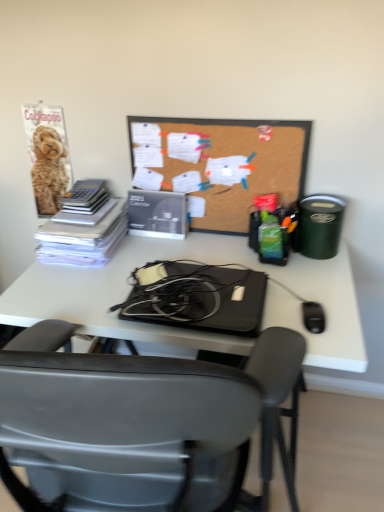
This screenshot has height=512, width=384. What are the coordinates of `matte black calendar at center` in the screenshot? It's located at (157, 214).

Describe the element at coordinates (196, 297) in the screenshot. This screenshot has width=384, height=512. I see `black matte laptop at center` at that location.

This screenshot has width=384, height=512. What are the coordinates of `white paper stack at left` in the screenshot? It's located at (84, 227).

What do you see at coordinates (313, 317) in the screenshot? The height and width of the screenshot is (512, 384). I see `black plastic mouse at lower right` at bounding box center [313, 317].

Locate an element on the screen. matte black calendar at center is located at coordinates (157, 214).

Is black matte laptop at center situated inside matte black calendar at center or outside?

black matte laptop at center is spatially situated outside matte black calendar at center.

Who is taller, black matte laptop at center or matte black calendar at center?

With more height is matte black calendar at center.

From the image's perspective, would you say black matte laptop at center is shown under matte black calendar at center?

Yes, from the image's perspective, black matte laptop at center is beneath matte black calendar at center.

Can you confirm if black plastic chair at center is thinner than matte black calendar at center?

Incorrect, the width of black plastic chair at center is not less than that of matte black calendar at center.

Looking at the image, does black plastic chair at center seem bigger or smaller compared to matte black calendar at center?

Clearly, black plastic chair at center is larger in size than matte black calendar at center.

Which of these two, corkboard at center or black plastic mouse at lower right, is wider?

With larger width is black plastic mouse at lower right.

Where is `bulletin board on the left of black plastic mouse at lower right`? Image resolution: width=384 pixels, height=512 pixels. bulletin board on the left of black plastic mouse at lower right is located at coordinates (220, 164).

Is corkboard at center located outside black plastic mouse at lower right?

Indeed, corkboard at center is completely outside black plastic mouse at lower right.

From their relative heights in the image, would you say corkboard at center is taller or shorter than black plastic mouse at lower right?

In the image, corkboard at center appears to be taller than black plastic mouse at lower right.

In terms of height, does black plastic mouse at lower right look taller or shorter compared to white paper stack at left?

Clearly, black plastic mouse at lower right is shorter compared to white paper stack at left.

Considering the relative positions of black plastic mouse at lower right and white paper stack at left in the image provided, is black plastic mouse at lower right to the left of white paper stack at left from the viewer's perspective?

No, black plastic mouse at lower right is not to the left of white paper stack at left.

Is the position of black plastic mouse at lower right more distant than that of white paper stack at left?

No.

Which of these two, black plastic mouse at lower right or white paper stack at left, is thinner?

black plastic mouse at lower right.

From the picture: What's the angular difference between black matte laptop at center and corkboard at center's facing directions?

The facing directions of black matte laptop at center and corkboard at center are 0.0148 degrees apart.

Is black matte laptop at center looking in the opposite direction of corkboard at center?

Yes, black matte laptop at center is facing away from corkboard at center.

Are black matte laptop at center and corkboard at center making contact?

There is a gap between black matte laptop at center and corkboard at center.

Is the position of black matte laptop at center less distant than that of black plastic chair at center?

No, black matte laptop at center is further to the viewer.

Consider the image. From a real-world perspective, is black matte laptop at center positioned above or below black plastic chair at center?

Clearly, from a real-world perspective, black matte laptop at center is above black plastic chair at center.

Considering the points (253, 277) and (134, 490), which point is in front, point (253, 277) or point (134, 490)?

The point (134, 490) is more forward.

From the image's perspective, is black matte laptop at center under black plastic chair at center?

No, from the image's perspective, black matte laptop at center is not below black plastic chair at center.

Considering the relative positions of black plastic mouse at lower right and black matte laptop at center in the image provided, is black plastic mouse at lower right behind black matte laptop at center?

Yes, it is behind black matte laptop at center.

Is black plastic mouse at lower right at the right side of black matte laptop at center?

Yes.

Considering the relative sizes of black plastic mouse at lower right and black matte laptop at center in the image provided, is black plastic mouse at lower right thinner than black matte laptop at center?

Yes.

You are a GUI agent. You are given a task and a screenshot of the screen. Output one action in this format:
    pyautogui.click(x=<x>, y=<y>)
    Task: Click on the laptop beneath the matte black calendar at center (from a real-world perspective)
    
    Given the screenshot: What is the action you would take?
    pyautogui.click(x=196, y=297)

The height and width of the screenshot is (512, 384). In order to click on chair below the matte black calendar at center (from the image's perspective) in this screenshot , I will do `click(138, 423)`.

Looking at the image, which one is located further to black plastic chair at center, corkboard at center or black plastic mouse at lower right?

corkboard at center.

When comparing their distances from matte black calendar at center, does black plastic mouse at lower right or corkboard at center seem further?

Among the two, black plastic mouse at lower right is located further to matte black calendar at center.

Estimate the real-world distances between objects in this image. Which object is further from black plastic chair at center, corkboard at center or black matte laptop at center?

Among the two, corkboard at center is located further to black plastic chair at center.

From the image, which object appears to be farther from white paper stack at left, matte black calendar at center or black plastic mouse at lower right?

Based on the image, black plastic mouse at lower right appears to be further to white paper stack at left.

Looking at the image, which one is located closer to white paper stack at left, black matte laptop at center or black plastic chair at center?

black matte laptop at center is positioned closer to the anchor white paper stack at left.

When comparing their distances from black plastic mouse at lower right, does white paper stack at left or black plastic chair at center seem closer?

black plastic chair at center is closer to black plastic mouse at lower right.

Based on their spatial positions, is black matte laptop at center or white paper stack at left further from corkboard at center?

black matte laptop at center is further to corkboard at center.

Estimate the real-world distances between objects in this image. Which object is closer to matte black calendar at center, black matte laptop at center or white paper stack at left?

Based on the image, white paper stack at left appears to be nearer to matte black calendar at center.

Locate an element on the screen. This screenshot has height=512, width=384. mouse between corkboard at center and black plastic chair at center vertically is located at coordinates (313, 317).

Identify the location of paperback book situated between white paper stack at left and corkboard at center from left to right. This screenshot has height=512, width=384. (157, 214).

Where is `bulletin board between black matte laptop at center and matte black calendar at center from front to back`? The image size is (384, 512). bulletin board between black matte laptop at center and matte black calendar at center from front to back is located at coordinates (220, 164).

Where is `paperback book situated between white paper stack at left and black plastic mouse at lower right from left to right`? paperback book situated between white paper stack at left and black plastic mouse at lower right from left to right is located at coordinates (157, 214).